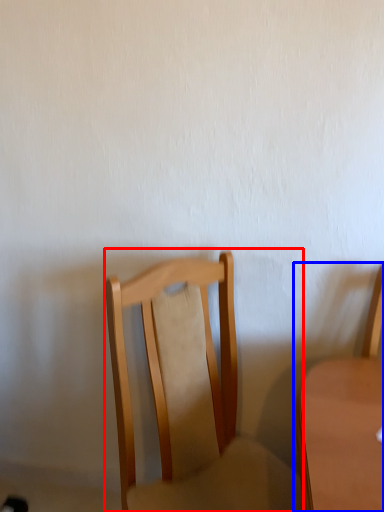
Question: Which point is closer to the camera, chair (highlighted by a red box) or chair (highlighted by a blue box)?

Choices:
 (A) chair
 (B) chair

Answer: (A)